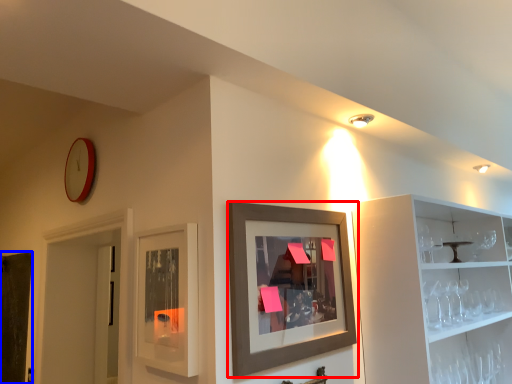
Question: Which of the following is the farthest to the observer, picture frame (highlighted by a red box) or door (highlighted by a blue box)?

Choices:
 (A) picture frame
 (B) door

Answer: (B)